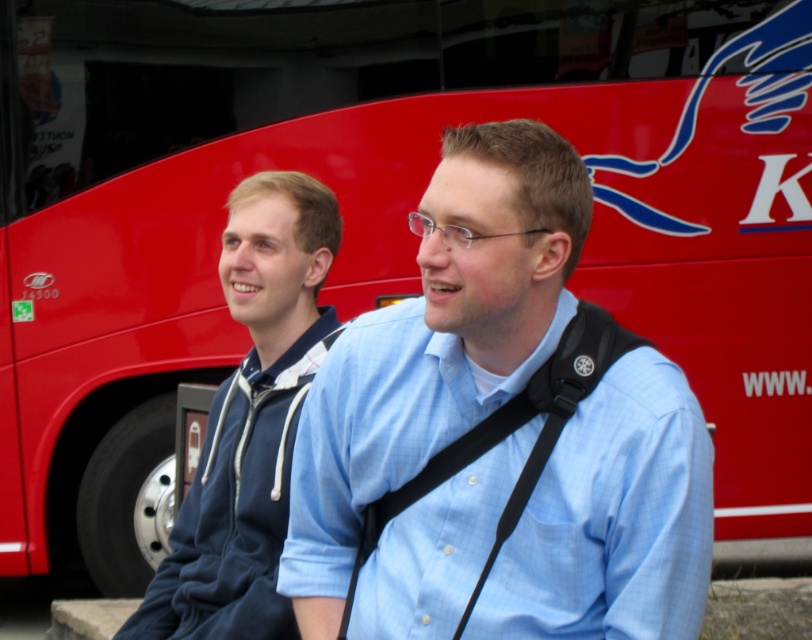
Question: Can you confirm if light blue shirt at center is positioned to the left of blue hoodie at left?

Choices:
 (A) yes
 (B) no

Answer: (B)

Question: Considering the real-world distances, which object is closest to the blue hoodie at left?

Choices:
 (A) black fabric strap at center
 (B) light blue shirt at center

Answer: (B)

Question: Among these points, which one is farthest from the camera?

Choices:
 (A) (502, 436)
 (B) (464, 509)
 (C) (180, 572)

Answer: (C)

Question: Among these points, which one is farthest from the camera?

Choices:
 (A) (585, 365)
 (B) (240, 216)

Answer: (B)

Question: Where is blue hoodie at left located in relation to black fabric strap at center in the image?

Choices:
 (A) above
 (B) below

Answer: (A)

Question: Can you confirm if light blue shirt at center is thinner than black fabric strap at center?

Choices:
 (A) no
 (B) yes

Answer: (A)